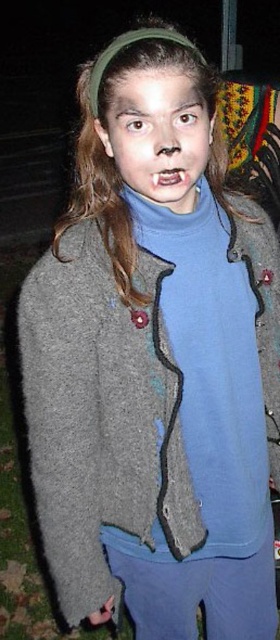
You are a photographer using a camera with a focal length of 50mm. You want to capture a closeup of the point at coordinates point [196,120] in the image. Given that the point is 95.53 centimeters away from the camera, what is the minimum distance you need to move the camera forward or backward to ensure the point fills the frame properly?

The point at coordinates point [196,120] is 95.53 centimeters away from the camera. To ensure it fills the frame properly, you would need to adjust the camera distance based on the sensor size and desired framing. However, without specific sensor dimensions or framing requirements, the exact distance adjustment cannot be calculated precisely.